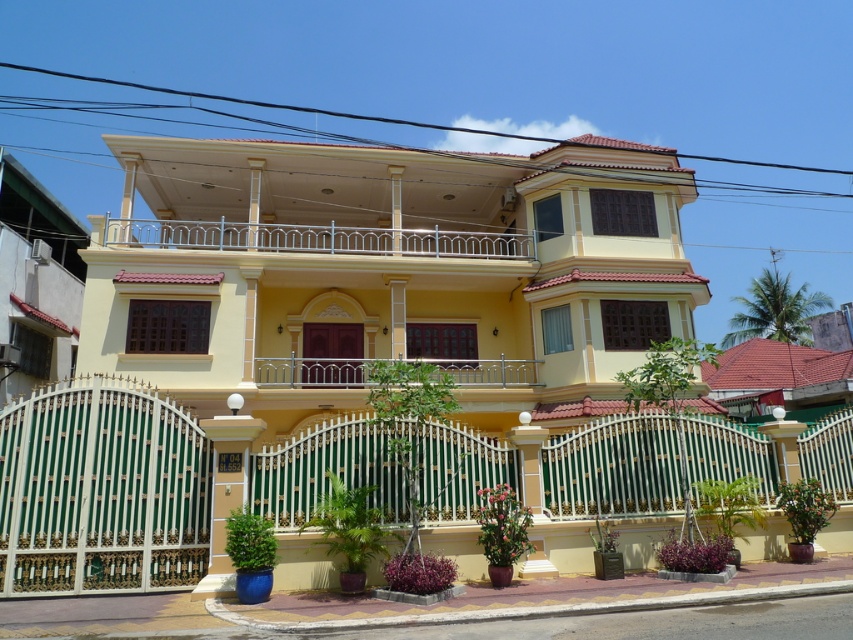
Question: Does green wrought iron fence at center have a greater width compared to silver metallic balcony at center?

Choices:
 (A) no
 (B) yes

Answer: (B)

Question: Is green wrought iron fence at center positioned behind silver metallic balcony at center?

Choices:
 (A) no
 (B) yes

Answer: (A)

Question: Which point is farther to the camera?

Choices:
 (A) green wrought iron fence at center
 (B) silver metallic balcony at center

Answer: (B)

Question: Among these points, which one is farthest from the camera?

Choices:
 (A) click(811, 424)
 (B) click(260, 378)

Answer: (B)

Question: Observing the image, what is the correct spatial positioning of green wrought iron fence at center in reference to silver metallic balcony at center?

Choices:
 (A) below
 (B) above

Answer: (A)